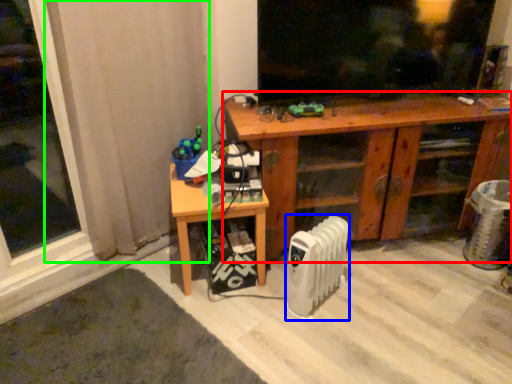
Question: Considering the real-world distances, which object is closest to desk (highlighted by a red box)? radiator (highlighted by a blue box) or curtain (highlighted by a green box).

Choices:
 (A) radiator
 (B) curtain

Answer: (A)